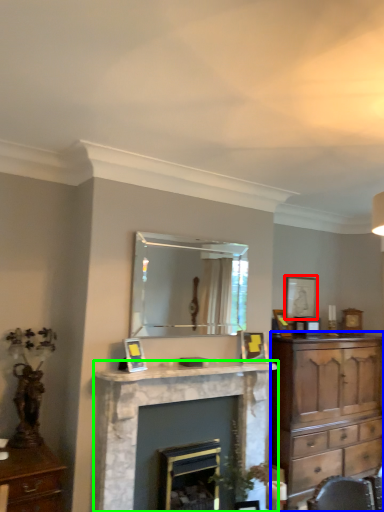
Question: Which object is positioned closest to picture frame (highlighted by a red box)? Select from chest of drawers (highlighted by a blue box) and fireplace (highlighted by a green box).

Choices:
 (A) chest of drawers
 (B) fireplace

Answer: (A)